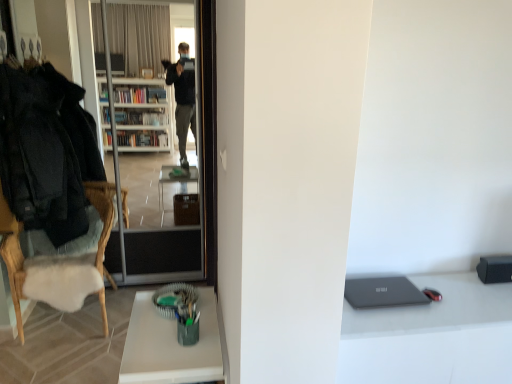
The width and height of the screenshot is (512, 384). I want to click on black woolen jacket at left, so click(46, 151).

In order to face white sheepskin cushion at left, should I rotate leftwards or rightwards?

You should rotate left by 23.482 degrees.

Locate an element on the screen. transparent glass screen door at left is located at coordinates (162, 142).

This screenshot has width=512, height=384. Describe the element at coordinates (162, 142) in the screenshot. I see `transparent glass screen door at left` at that location.

Find the location of a particular element. The image size is (512, 384). black woolen jacket at left is located at coordinates (46, 151).

Who is shorter, white sheepskin cushion at left or matte gray laptop at lower right?

matte gray laptop at lower right.

Is white sheepskin cushion at left positioned with its back to matte gray laptop at lower right?

white sheepskin cushion at left does not have its back to matte gray laptop at lower right.

Which point is more distant from viewer, (104, 187) or (408, 286)?

The point (104, 187) is farther from the camera.

Which object is thinner, white sheepskin cushion at left or matte gray laptop at lower right?

matte gray laptop at lower right is thinner.

Which object is closer to the camera, green matte cup at lower center or matte gray laptop at lower right?

green matte cup at lower center is in front.

Between green matte cup at lower center and matte gray laptop at lower right, which one has less height?

Standing shorter between the two is matte gray laptop at lower right.

Is green matte cup at lower center far away from matte gray laptop at lower right?

green matte cup at lower center is near matte gray laptop at lower right, not far away.

Is green matte cup at lower center turned away from matte gray laptop at lower right?

Yes, green matte cup at lower center is facing away from matte gray laptop at lower right.

Is black woolen jacket at left a part of green matte cup at lower center?

Definitely not — black woolen jacket at left is not inside green matte cup at lower center.

Is green matte cup at lower center positioned far away from black woolen jacket at left?

green matte cup at lower center is far away from black woolen jacket at left.

From the image's perspective, between green matte cup at lower center and black woolen jacket at left, which one is located above?

black woolen jacket at left, from the image's perspective.

Is satin black laptop at right aimed at green matte cup at lower center?

No.

From the image's perspective, is satin black laptop at right located beneath green matte cup at lower center?

No, from the image's perspective, satin black laptop at right is not beneath green matte cup at lower center.

In the scene shown: Would you say satin black laptop at right contains green matte cup at lower center?

Definitely not — green matte cup at lower center is not inside satin black laptop at right.

Are satin black laptop at right and green matte cup at lower center making contact?

No, satin black laptop at right is not next to green matte cup at lower center.

Between satin black laptop at right and matte gray laptop at lower right, which one has smaller size?

Smaller between the two is matte gray laptop at lower right.

Which is more to the right, satin black laptop at right or matte gray laptop at lower right?

From the viewer's perspective, satin black laptop at right appears more on the right side.

Can you tell me how much satin black laptop at right and matte gray laptop at lower right differ in facing direction?

The angular difference between satin black laptop at right and matte gray laptop at lower right is 8.54e-05 degrees.

Would you say satin black laptop at right is a long distance from matte gray laptop at lower right?

satin black laptop at right is near matte gray laptop at lower right, not far away.

Between black woolen jacket at left and transparent glass screen door at left, which one has larger width?

Wider between the two is black woolen jacket at left.

From the picture: Is there a large distance between black woolen jacket at left and transparent glass screen door at left?

No, black woolen jacket at left is not far away from transparent glass screen door at left.

Considering the sizes of objects black woolen jacket at left and transparent glass screen door at left in the image provided, who is taller, black woolen jacket at left or transparent glass screen door at left?

transparent glass screen door at left.

From the picture: From the image's perspective, is black woolen jacket at left under white sheepskin cushion at left?

Actually, black woolen jacket at left appears above white sheepskin cushion at left in the image.

Is point (19, 150) positioned behind point (3, 202)?

No, (19, 150) is closer to viewer.

You are a GUI agent. You are given a task and a screenshot of the screen. Output one action in this format:
    pyautogui.click(x=<x>, y=<y>)
    Task: Click on the jacket lying above the white sheepskin cushion at left (from the image's perspective)
    
    Given the screenshot: What is the action you would take?
    pyautogui.click(x=46, y=151)

Identify the location of laptop in front of the white sheepskin cushion at left. Image resolution: width=512 pixels, height=384 pixels. (382, 292).

This screenshot has height=384, width=512. Identify the location of desk below the matte gray laptop at lower right (from the image's perspective). (170, 345).

Which object lies further to the anchor point satin black laptop at right, black woolen jacket at left or transparent glass screen door at left?

transparent glass screen door at left is positioned further to the anchor satin black laptop at right.

Estimate the real-world distances between objects in this image. Which object is further from matte gray laptop at lower right, black woolen jacket at left or satin black laptop at right?

black woolen jacket at left.

From the image, which object appears to be nearer to transparent glass screen door at left, black woolen jacket at left or matte gray laptop at lower right?

black woolen jacket at left is closer to transparent glass screen door at left.

When comparing their distances from matte gray laptop at lower right, does green matte cup at lower center or white sheepskin cushion at left seem closer?

The object closer to matte gray laptop at lower right is green matte cup at lower center.

Looking at the image, which one is located further to transparent glass screen door at left, white sheepskin cushion at left or satin black laptop at right?

satin black laptop at right.

Estimate the real-world distances between objects in this image. Which object is further from transparent glass screen door at left, black woolen jacket at left or green matte cup at lower center?

green matte cup at lower center.

Looking at the image, which one is located closer to satin black laptop at right, green matte cup at lower center or matte gray laptop at lower right?

The object closer to satin black laptop at right is matte gray laptop at lower right.

Looking at the image, which one is located closer to black woolen jacket at left, satin black laptop at right or white sheepskin cushion at left?

Among the two, white sheepskin cushion at left is located nearer to black woolen jacket at left.

Locate an element on the screen. screen door between black woolen jacket at left and satin black laptop at right from left to right is located at coordinates (162, 142).

Find the location of `laptop situated between white sheepskin cushion at left and satin black laptop at right from left to right`. laptop situated between white sheepskin cushion at left and satin black laptop at right from left to right is located at coordinates (382, 292).

You are a GUI agent. You are given a task and a screenshot of the screen. Output one action in this format:
    pyautogui.click(x=<x>, y=<y>)
    Task: Click on the jacket between transparent glass screen door at left and white sheepskin cushion at left in the up-down direction
    This screenshot has width=512, height=384.
    Given the screenshot: What is the action you would take?
    pyautogui.click(x=46, y=151)

The width and height of the screenshot is (512, 384). I want to click on chair that lies between black woolen jacket at left and green matte cup at lower center from top to bottom, so click(x=59, y=267).